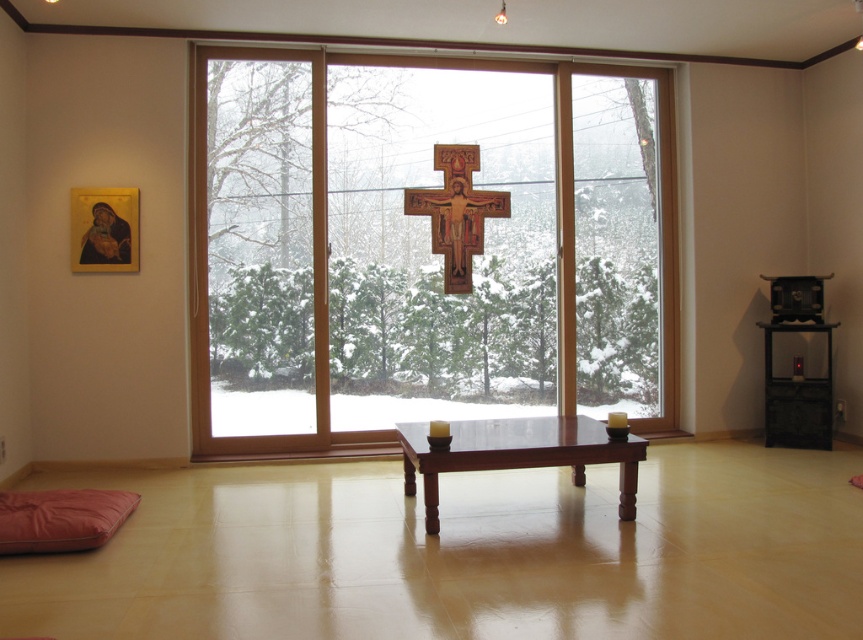
Question: Among these points, which one is farthest from the camera?

Choices:
 (A) (465, 179)
 (B) (339, 112)
 (C) (536, 422)
 (D) (104, 538)

Answer: (A)

Question: Which is farther from the wooden crucifix at center?

Choices:
 (A) mahogany wood table at center
 (B) matte pink yoga mat at lower left

Answer: (B)

Question: Can you confirm if transparent wood glass door at center is positioned above matte pink yoga mat at lower left?

Choices:
 (A) yes
 (B) no

Answer: (A)

Question: Is transparent wood glass door at center thinner than wooden crucifix at center?

Choices:
 (A) yes
 (B) no

Answer: (B)

Question: Which of the following is the closest to the observer?

Choices:
 (A) (476, 426)
 (B) (458, 289)
 (C) (426, 257)

Answer: (A)

Question: In this image, where is mahogany wood table at center located relative to wooden crucifix at center?

Choices:
 (A) left
 (B) right

Answer: (B)